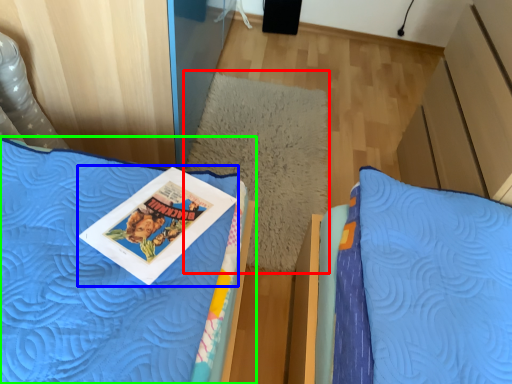
Question: Which is farther away from pillow (highlighted by a red box)? comic book (highlighted by a blue box) or bed (highlighted by a green box)?

Choices:
 (A) comic book
 (B) bed

Answer: (A)